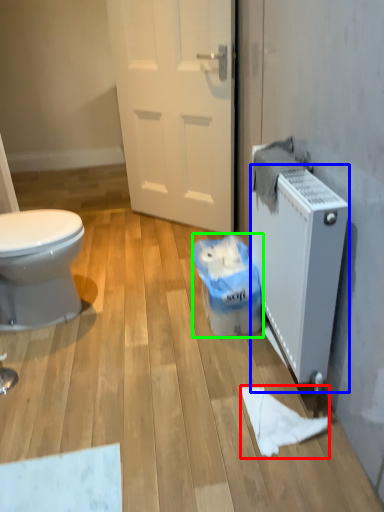
Question: Estimate the real-world distances between objects in this image. Which object is farther from toilet paper (highlighted by a red box), radiator (highlighted by a blue box) or garbage (highlighted by a green box)?

Choices:
 (A) radiator
 (B) garbage

Answer: (B)